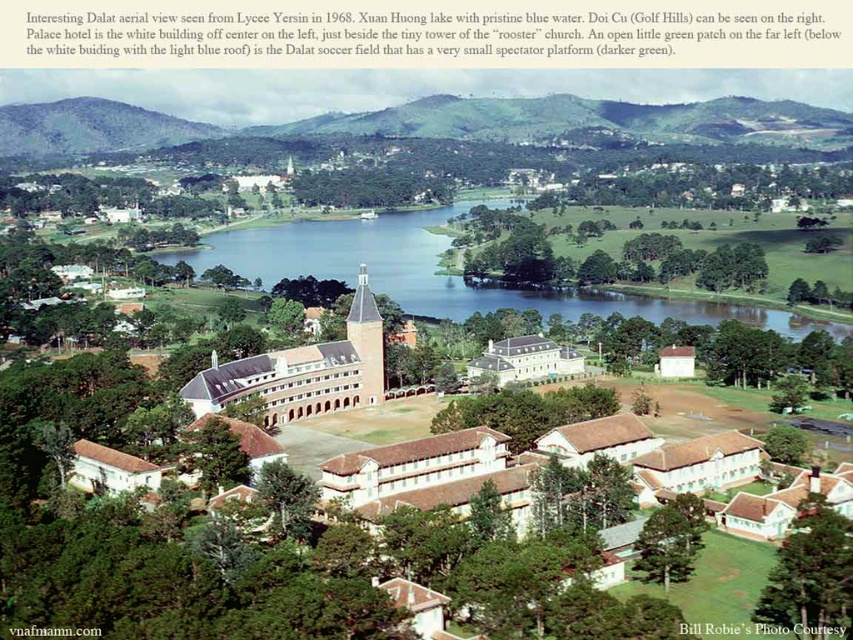
Question: Is clear blue water at center to the left of beige brick building at center from the viewer's perspective?

Choices:
 (A) yes
 (B) no

Answer: (B)

Question: Based on their relative distances, which object is farther from the white smooth building at center?

Choices:
 (A) beige brick building at center
 (B) green grassy hill at upper left
 (C) matte beige building at center
 (D) clear blue water at center

Answer: (B)

Question: Can you confirm if clear blue water at center is positioned below matte beige building at center?

Choices:
 (A) yes
 (B) no

Answer: (B)

Question: Is beige brick building at center further to the viewer compared to matte beige building at center?

Choices:
 (A) no
 (B) yes

Answer: (A)

Question: Which point appears farthest from the camera in this image?

Choices:
 (A) (273, 371)
 (B) (686, 321)

Answer: (B)

Question: Which point is closer to the camera?

Choices:
 (A) (21, 106)
 (B) (260, 385)
 (C) (392, 268)

Answer: (B)